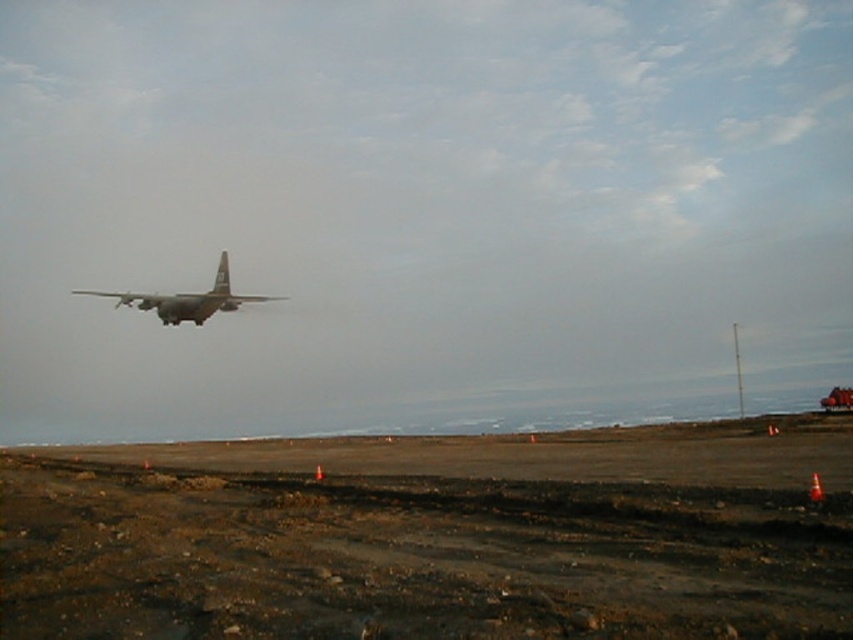
You are a pilot preparing to land the camouflage fabric airplane at upper center. You notice the brown dirt track at lower center ahead. Based on the scene, can you determine if the dirt track is part of the runway or a separate path?

The brown dirt track at lower center is in front of the camouflage fabric airplane at upper center, which suggests it might be part of the runway or a separate path. However, without additional information about the runway layout or markings, it is unclear if the dirt track is the intended landing area.

You are a pilot preparing to land a small aircraft on the brown dirt track at lower center and the brown dirt field at lower center. Which surface should you choose for a safer landing based on their elevation?

The brown dirt track at lower center has a lesser height compared to the brown dirt field at lower center, so it is safer to land on the brown dirt track at lower center because lower elevation might provide better visibility and stability during landing.

You are a drone operator trying to land your drone on the brown dirt track at lower center. However, you notice the brown dirt field at lower center nearby. Which area do you think has more space for a safe landing? Please explain your reasoning based on the scene.

The brown dirt field at lower center has more space for a safe landing because it occupies more area than the brown dirt track at lower center according to the description.